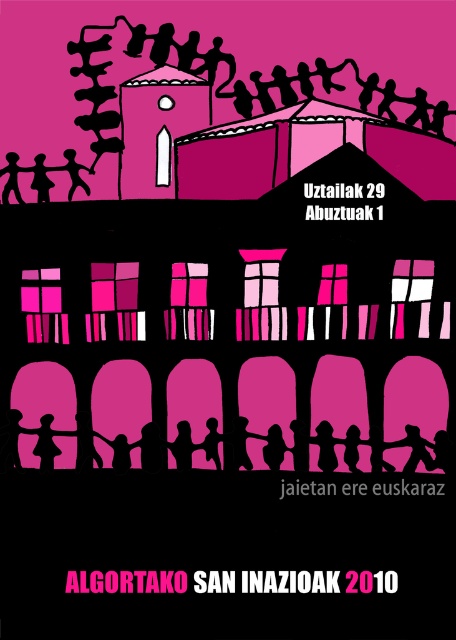
Does silhouette figure at lower center appear under matte black figure at upper left?

Yes.

Between point (13, 420) and point (11, 172), which one is positioned behind?

Point (11, 172)

The height and width of the screenshot is (640, 456). I want to click on silhouette figure at lower center, so click(84, 445).